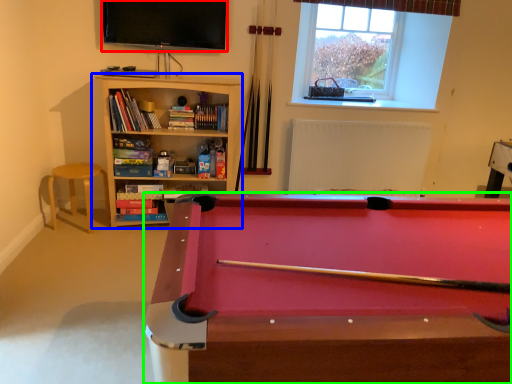
Question: Based on their relative distances, which object is farther from television (highlighted by a red box)? Choose from bookcase (highlighted by a blue box) and billiard table (highlighted by a green box).

Choices:
 (A) bookcase
 (B) billiard table

Answer: (B)